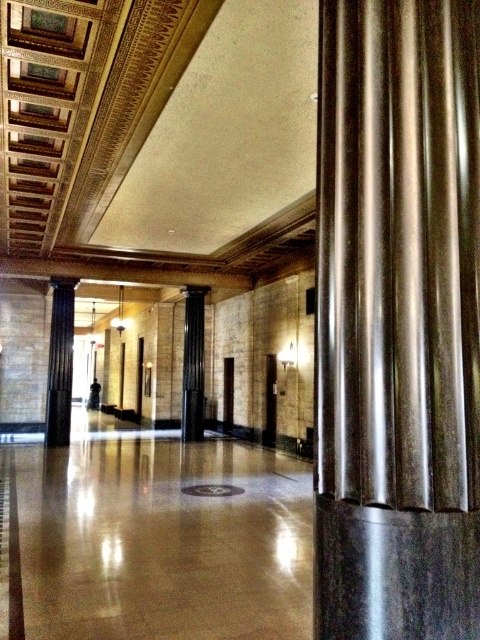
Question: Can you confirm if metallic polished column at center is smaller than black polished column at left?

Choices:
 (A) no
 (B) yes

Answer: (B)

Question: Which of the following is the farthest from the observer?

Choices:
 (A) metallic polished column at center
 (B) black polished column at center

Answer: (B)

Question: Is metallic polished column at center to the left of black polished column at center from the viewer's perspective?

Choices:
 (A) yes
 (B) no

Answer: (B)

Question: Does black polished column at left have a greater width compared to black polished column at center?

Choices:
 (A) no
 (B) yes

Answer: (B)

Question: Among these points, which one is farthest from the camera?

Choices:
 (A) (49, 344)
 (B) (194, 332)
 (C) (367, 304)

Answer: (B)

Question: Which of the following is the farthest from the observer?

Choices:
 (A) tap(192, 388)
 (B) tap(342, 349)
 (C) tap(48, 403)

Answer: (A)